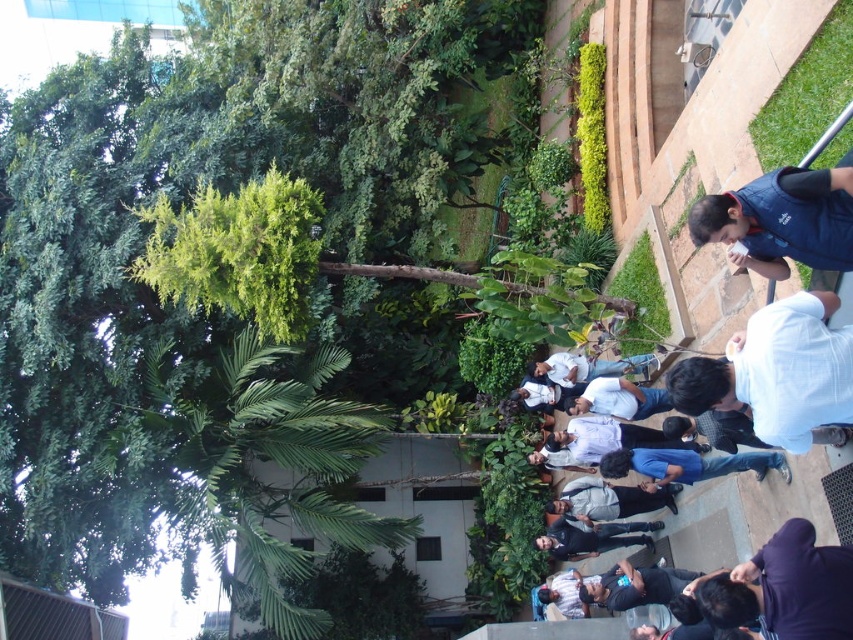
Does white cotton shirt at lower right have a lesser width compared to blue fleece vest at upper right?

No.

Does white cotton shirt at lower right have a lesser height compared to blue fleece vest at upper right?

Incorrect, white cotton shirt at lower right's height does not fall short of blue fleece vest at upper right's.

Between point (813, 330) and point (846, 208), which one is positioned behind?

The point (846, 208) is more distant.

Where is `white cotton shirt at lower right`? The height and width of the screenshot is (640, 853). white cotton shirt at lower right is located at coordinates (776, 372).

Based on the photo, who is more forward, (817, 417) or (807, 552)?

Positioned in front is point (807, 552).

Describe the element at coordinates (776, 372) in the screenshot. This screenshot has width=853, height=640. I see `white cotton shirt at lower right` at that location.

Locate an element on the screen. white cotton shirt at lower right is located at coordinates click(x=776, y=372).

Does blue fleece vest at upper right appear on the right side of blue denim jeans at lower center?

In fact, blue fleece vest at upper right is to the left of blue denim jeans at lower center.

Does blue fleece vest at upper right have a greater height compared to blue denim jeans at lower center?

Correct, blue fleece vest at upper right is much taller as blue denim jeans at lower center.

Measure the distance between point (763, 256) and camera.

Point (763, 256) and camera are 10.93 meters apart.

Find the location of `blue fleece vest at upper right`. blue fleece vest at upper right is located at coordinates (782, 220).